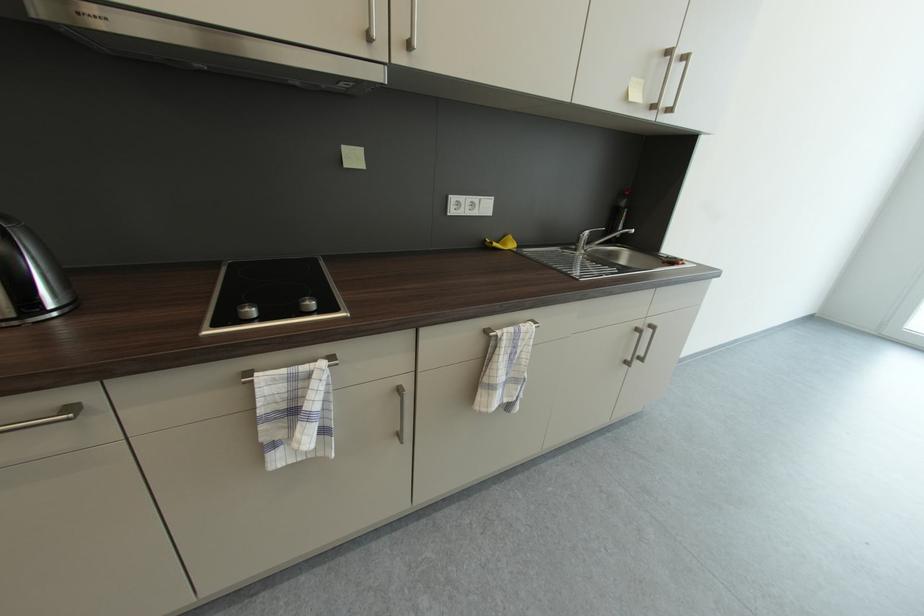
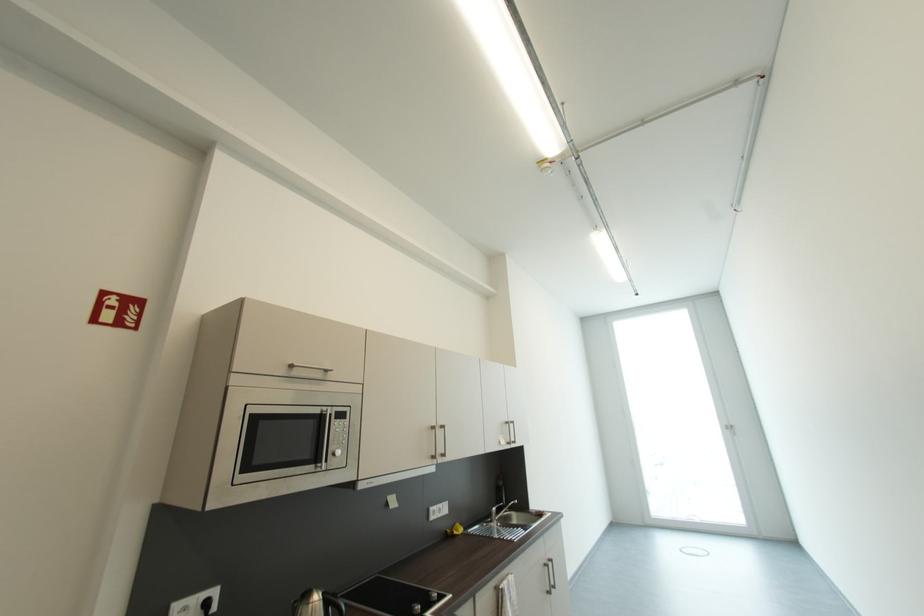
Locate, in the second image, the point that corresponds to pixel 675 54 in the first image.

(513, 424)